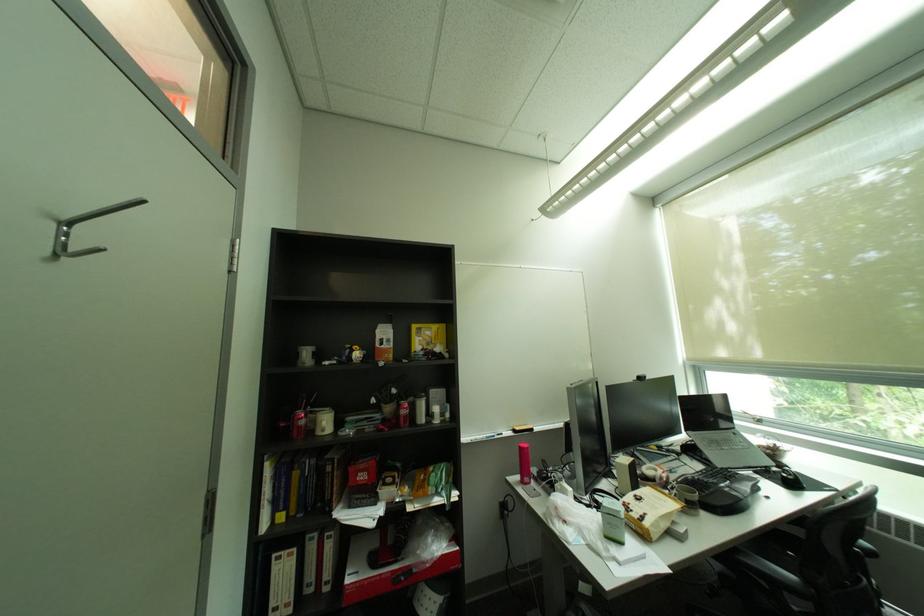
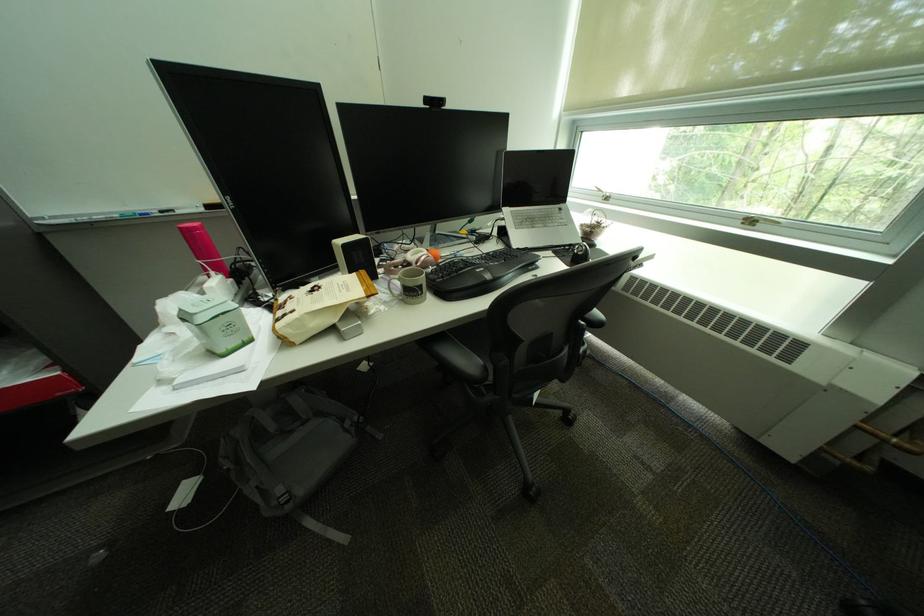
Find the pixel in the second image that matches pixel 667 522 in the first image.

(309, 321)